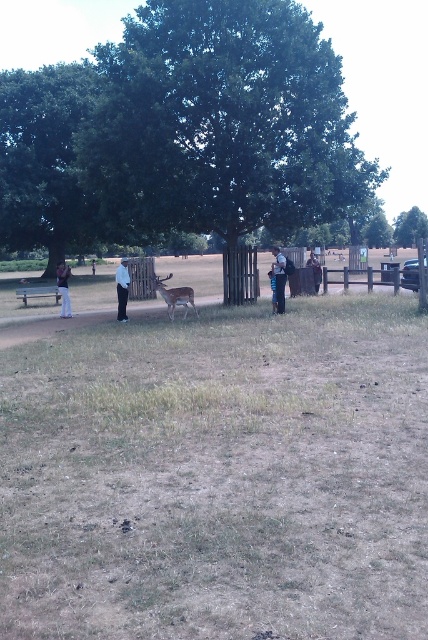
Looking at this image, you are a photographer trying to capture a photo of the green leafy tree at center and the dark blue jeans at center. Which object should you focus on first if you want to ensure both are in frame without moving the camera?

The green leafy tree at center is taller than the dark blue jeans at center, so you should focus on the green leafy tree at center first to ensure it fits within the frame before adjusting for the smaller object.

You are planning to take a photo of the brown velvet deer at center from the left side of the dirt path. Based on its position, will you need to move towards the left or right side of the path to get a clear shot?

The brown velvet deer at center is located at point 0.409 on the horizontal axis, which means it is positioned slightly to the left of the center. To get a clear shot from the left side of the dirt path, you should move towards the right side of the path to align with the deer.

From the picture: You are a photographer trying to capture a clear shot of both the brown wooden fence at center and the white fabric shirt at center. Given their sizes, which object should you focus on first to ensure it appears sharp in the photo?

The brown wooden fence at center has a larger size compared to the white fabric shirt at center, so you should focus on the brown wooden fence at center first to ensure it appears sharp in the photo.